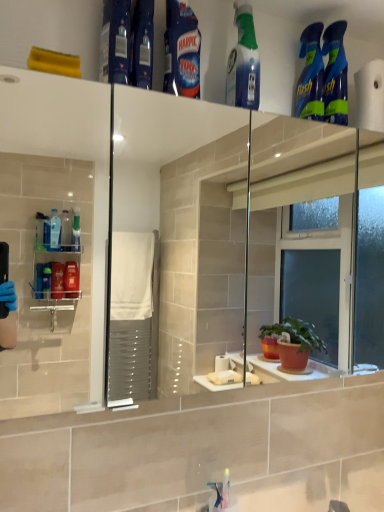
Question: Which direction should I rotate to look at blue glossy harpic at upper center, marked as the 4th cleaning product in a right-to-left arrangement?

Choices:
 (A) right
 (B) left

Answer: (B)

Question: Is blue plastic bottle at upper center surrounded by white matte toilet paper at upper right?

Choices:
 (A) yes
 (B) no

Answer: (B)

Question: Would you consider white matte toilet paper at upper right to be distant from blue plastic bottle at upper center?

Choices:
 (A) no
 (B) yes

Answer: (A)

Question: Is white matte toilet paper at upper right positioned with its back to blue plastic bottle at upper center?

Choices:
 (A) no
 (B) yes

Answer: (A)

Question: Is white matte toilet paper at upper right wider than blue plastic bottle at upper center?

Choices:
 (A) yes
 (B) no

Answer: (B)

Question: From the image's perspective, does white matte toilet paper at upper right appear higher than blue plastic bottle at upper center?

Choices:
 (A) yes
 (B) no

Answer: (B)

Question: Is white matte toilet paper at upper right oriented towards blue plastic bottle at upper center?

Choices:
 (A) yes
 (B) no

Answer: (B)

Question: Considering the relative sizes of blue glossy spray bottles at upper right, which ranks as the second cleaning product in right-to-left order, and blue plastic bottle at upper center in the image provided, is blue glossy spray bottles at upper right, which ranks as the second cleaning product in right-to-left order, bigger than blue plastic bottle at upper center?

Choices:
 (A) yes
 (B) no

Answer: (B)

Question: Does blue glossy spray bottles at upper right, the 4th cleaning product positioned from the left, have a greater height compared to blue plastic bottle at upper center?

Choices:
 (A) no
 (B) yes

Answer: (B)

Question: Does blue glossy spray bottles at upper right, the 4th cleaning product positioned from the left, appear on the right side of blue plastic bottle at upper center?

Choices:
 (A) yes
 (B) no

Answer: (A)

Question: Is blue glossy spray bottles at upper right, which ranks as the second cleaning product in right-to-left order, to the left of blue plastic bottle at upper center from the viewer's perspective?

Choices:
 (A) no
 (B) yes

Answer: (A)

Question: Would you say blue glossy spray bottles at upper right, which ranks as the second cleaning product in right-to-left order, contains blue plastic bottle at upper center?

Choices:
 (A) yes
 (B) no

Answer: (B)

Question: Is blue glossy spray bottles at upper right, which ranks as the second cleaning product in right-to-left order, oriented away from blue plastic bottle at upper center?

Choices:
 (A) yes
 (B) no

Answer: (B)

Question: From the image's perspective, does blue glossy spray bottles at upper right, which is the 1th cleaning product from right to left, appear lower than blue glossy harpic at upper center, marked as the 4th cleaning product in a right-to-left arrangement?

Choices:
 (A) no
 (B) yes

Answer: (B)